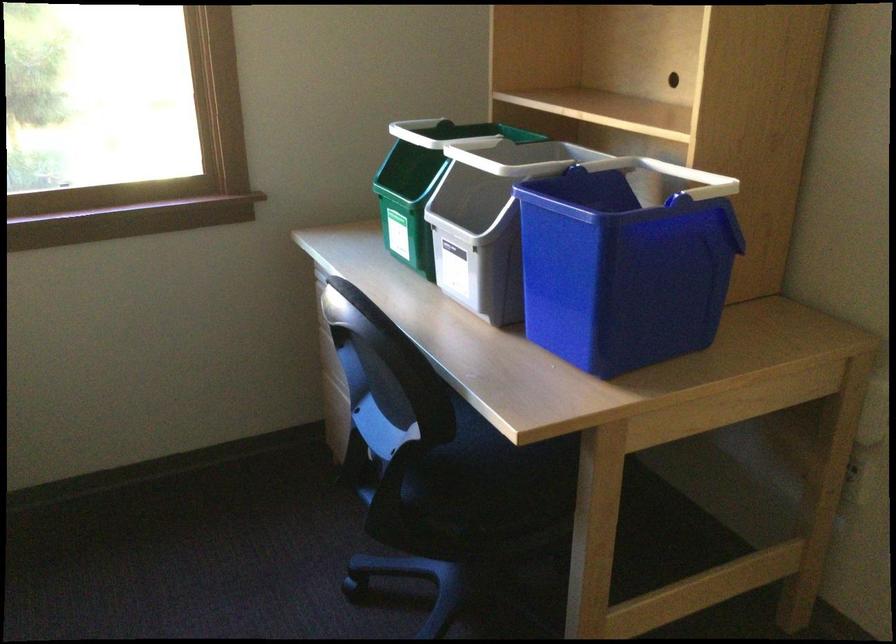
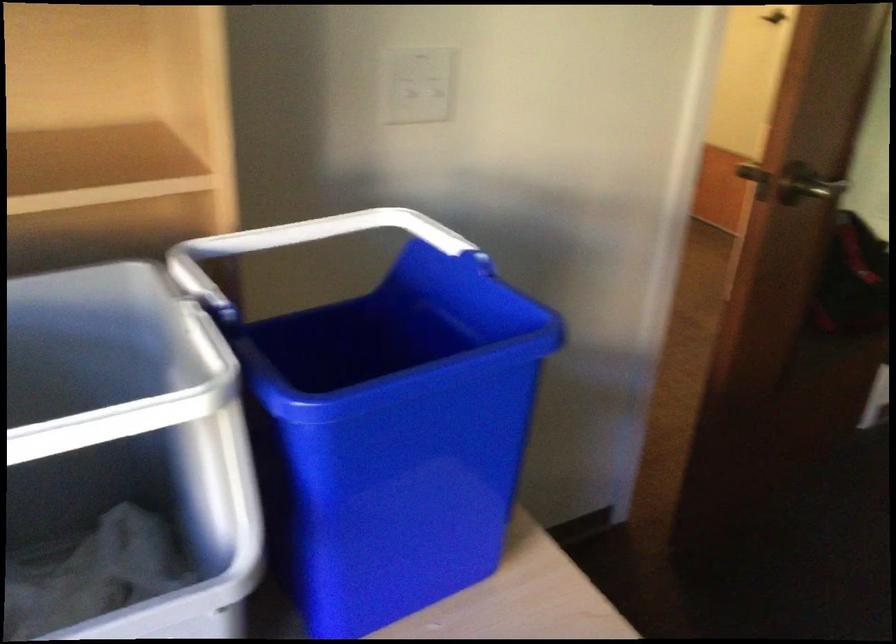
In the second image, find the point that corresponds to [650,166] in the first image.

(213, 257)